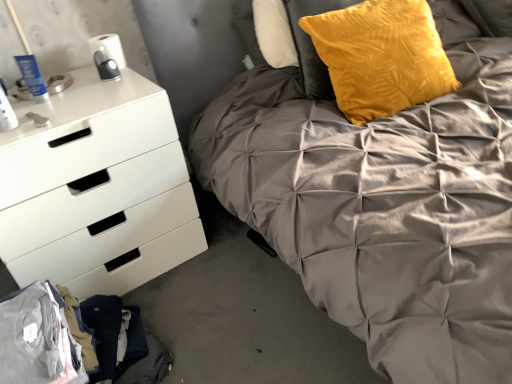
Question: Would you say white matte chest of drawers at left is to the left or to the right of matte gray quilted bed at center in the picture?

Choices:
 (A) right
 (B) left

Answer: (B)

Question: Considering the positions of white matte chest of drawers at left and matte gray quilted bed at center in the image, is white matte chest of drawers at left bigger or smaller than matte gray quilted bed at center?

Choices:
 (A) small
 (B) big

Answer: (A)

Question: Based on their relative distances, which object is farther from the matte gray quilted bed at center?

Choices:
 (A) velvet yellow pillow at upper right
 (B) white matte chest of drawers at left

Answer: (B)

Question: Which object is positioned farthest from the velvet yellow pillow at upper right?

Choices:
 (A) matte gray quilted bed at center
 (B) white matte chest of drawers at left

Answer: (B)